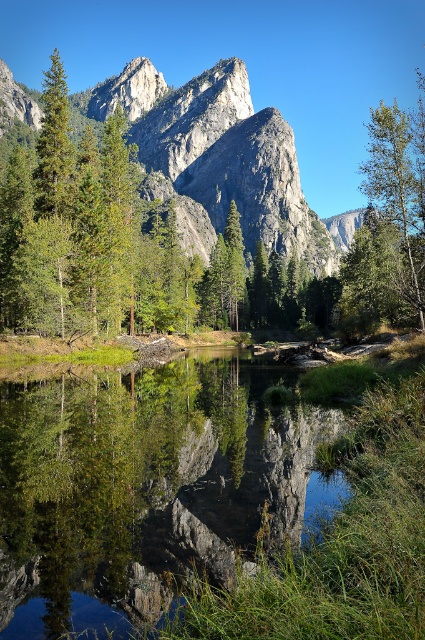
You are standing at the center of the image and want to reach the green matte tree at right. Which direction should you move to get there?

The green matte tree at right is located at point 0.306 on the x and 0.939 on the y coordinates, so you should move to the right and slightly upwards to reach it.

What is the location of the rugged granite mountain at center in the image?

The rugged granite mountain at center is located at point (218, 157).

You are standing at the water edge in the scene. You see two points marked in the image. Which point, point (x=207, y=250) or point (x=394, y=120), is closer to you?

Point (x=394, y=120) is closer to you because it is in front of point (x=207, y=250).